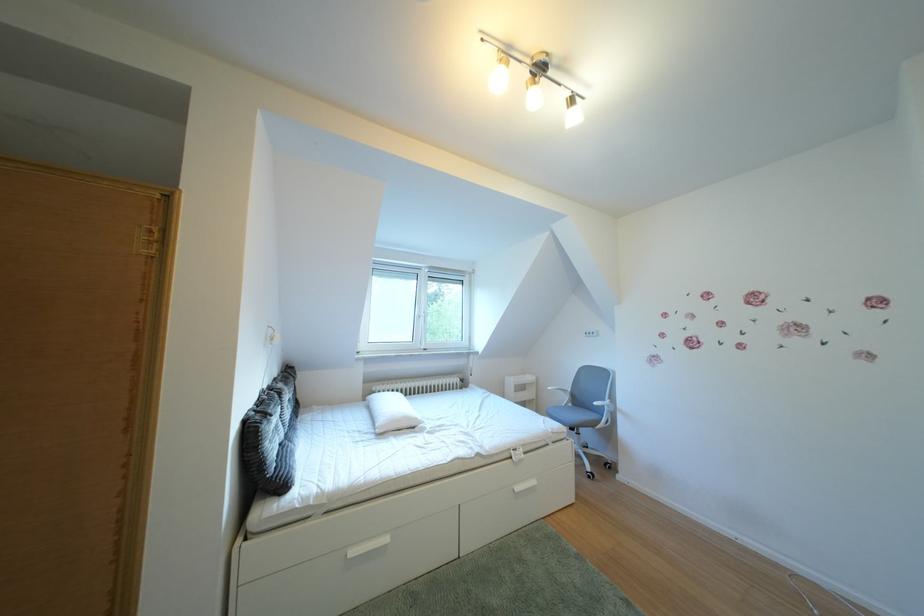
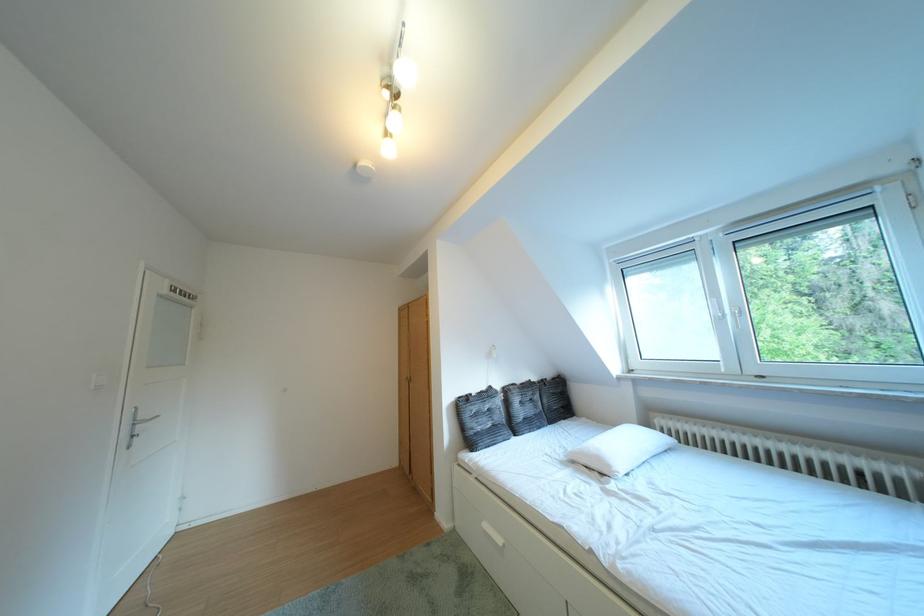
The point at (430, 424) is marked in the first image. Where is the corresponding point in the second image?

(623, 471)